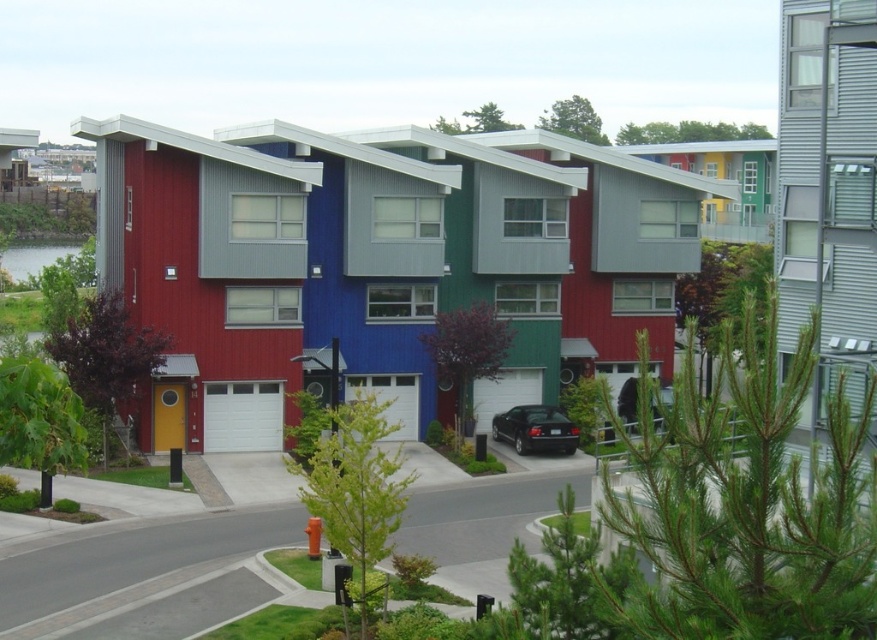
You are standing at the point with coordinates (535,429) in the image. What object are you currently at?

You are at the black glossy car at center, which is represented by the point with coordinates (535,429).

You are a delivery driver who needs to park your vehicle, which is the same size as the clear water at lower left. You see the black glossy car at center parked in the middle of the road. Can you safely park your vehicle next to it without overlapping?

The black glossy car at center has a smaller size compared to clear water at lower left. Since your vehicle is the same size as the clear water at lower left, it is larger than the parked car. You should check if there is enough space to park next to it without overlapping, but the size difference may require more space.

You are standing on the paved road in front of the townhouses and want to take a photo of both the black glossy car at center and the clear water at lower left. Which object should you adjust your camera focus on first to ensure both are in the frame?

The black glossy car at center is closer to the viewer than the clear water at lower left, so you should focus on the black glossy car at center first to ensure both are in focus.